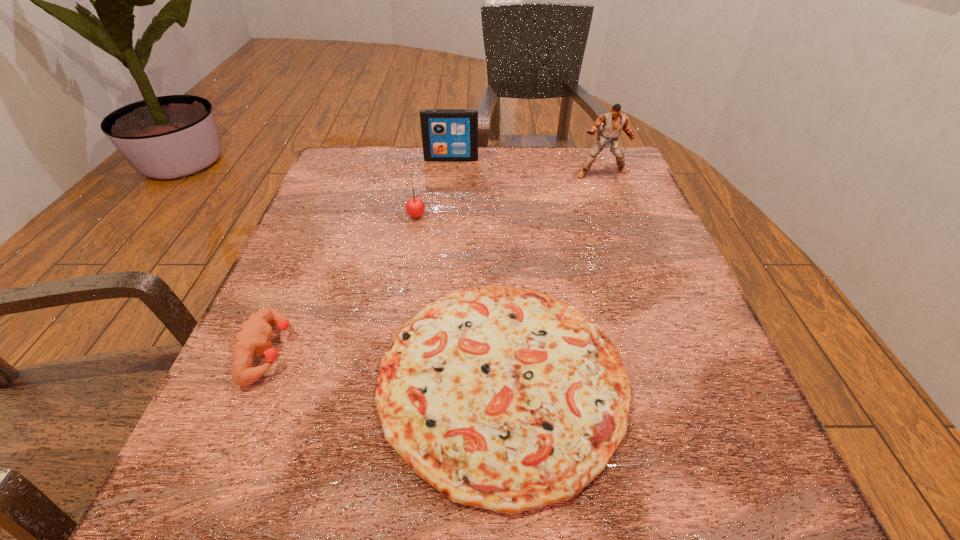
Image resolution: width=960 pixels, height=540 pixels. In order to click on vacant space located on the front screen of the iPod in this screenshot , I will do `click(445, 221)`.

Where is `vacant space located 0.380m on the front of the cherry`? vacant space located 0.380m on the front of the cherry is located at coordinates (389, 373).

The image size is (960, 540). I want to click on free space located with the gloves of the nearer puncher facing forward, so click(x=358, y=351).

I want to click on free space located 0.200m on the back of the pizza, so click(496, 223).

You are a GUI agent. You are given a task and a screenshot of the screen. Output one action in this format:
    pyautogui.click(x=<x>, y=<y>)
    Task: Click on the puncher that is at the far edge
    
    Given the screenshot: What is the action you would take?
    pyautogui.click(x=613, y=122)

This screenshot has height=540, width=960. Find the location of `iPod that is at the far edge`. iPod that is at the far edge is located at coordinates (447, 134).

Identify the location of object located in the near edge section of the desktop. (502, 398).

Where is `object present at the left edge`? object present at the left edge is located at coordinates (253, 337).

Where is `puncher present at the right edge`? This screenshot has width=960, height=540. puncher present at the right edge is located at coordinates (613, 122).

Locate an element on the screen. pizza at the right edge is located at coordinates (502, 398).